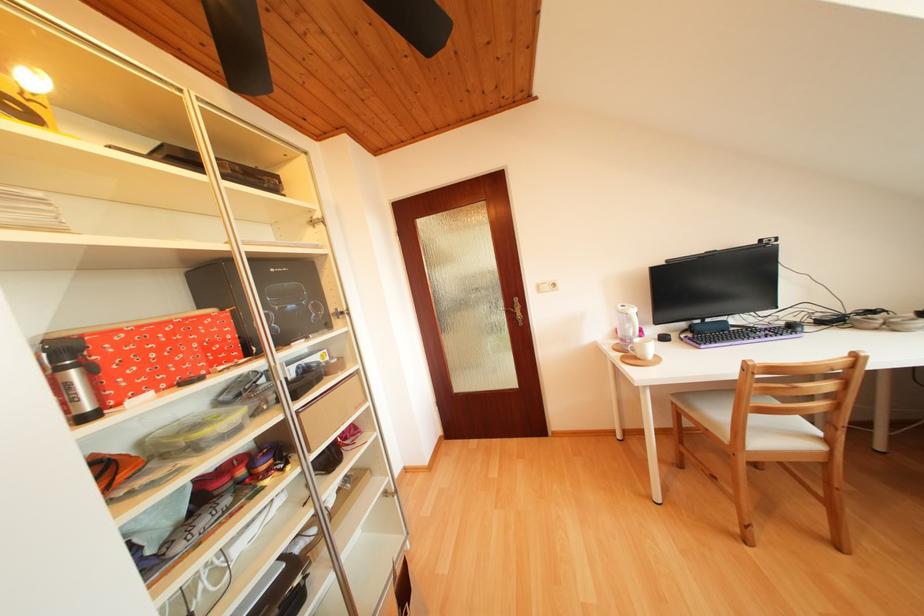
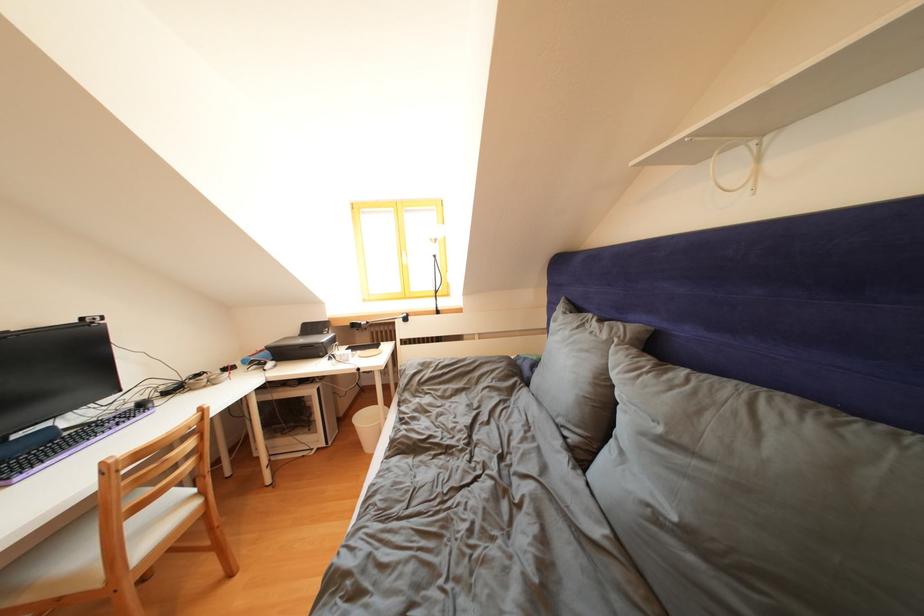
Locate, in the second image, the point that corresponds to point (792, 440) in the first image.

(175, 522)